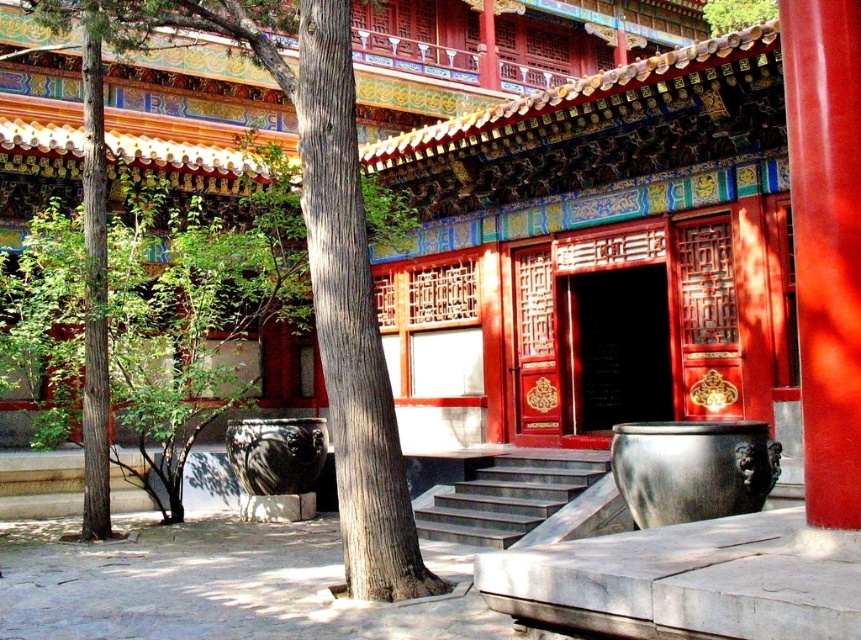
You are standing at the entrance of the temple and want to walk towards the brown textured tree at center. Which direction should you go relative to the dark gray stone stairs at center?

The brown textured tree at center is positioned over dark gray stone stone stairs at center, so you should walk towards the stairs to reach the tree.